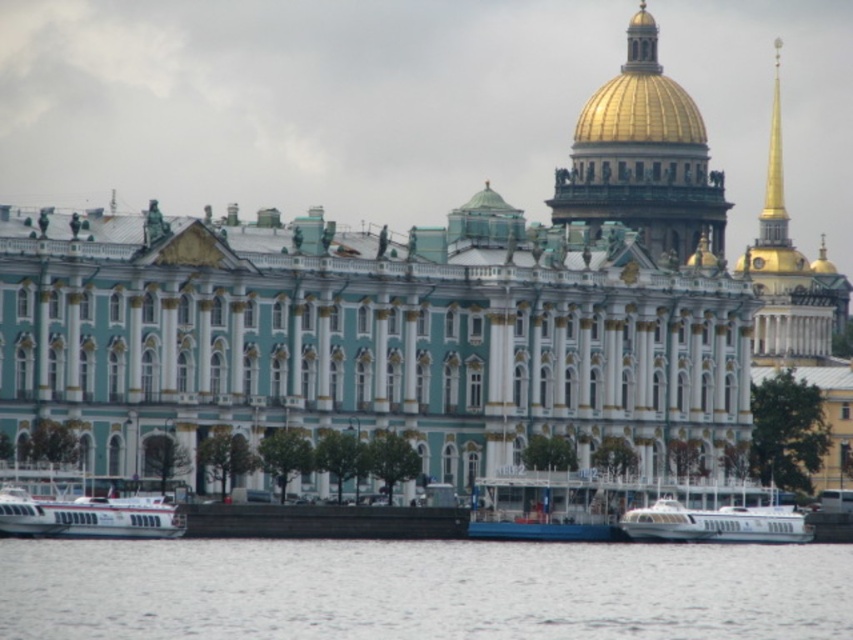
You are a tour guide leading a group of visitors. You want to point out the blue painted metal boat at center and the golden dome on the building. How far apart are these two landmarks?

The blue painted metal boat at center and the golden dome on the building are 107.08 meters apart.

Consider the image. You are standing in front of the grand building and notice the white matte boat at lower left and the gold polished dome at upper center. Which object would appear larger to you based on their positions?

The white matte boat at lower left is closer to the viewer than the gold polished dome at upper center, so it would appear larger due to its proximity.

You are standing on the dock and want to board the white glossy boat at lower center. Which direction should you walk to reach it from the white water at lower center?

You should walk to the right from the white water at lower center to reach the white glossy boat at lower center because the white water at lower center is to the left of the white glossy boat at lower center.